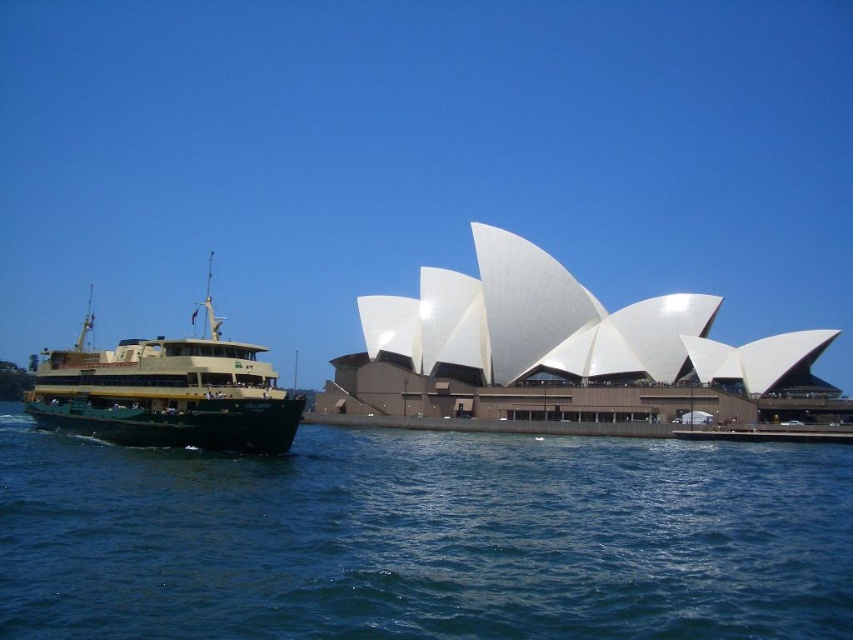
You are a tourist standing at the Sydney Opera House and want to take a ferry to Circular Quay. You see the blue water at lower left in the image. Based on its position, can you determine if the ferry is located to the left or right of the Sydney Opera House?

The blue water at lower left is located at position point (422, 538), so the ferry is to the right of the Sydney Opera House.